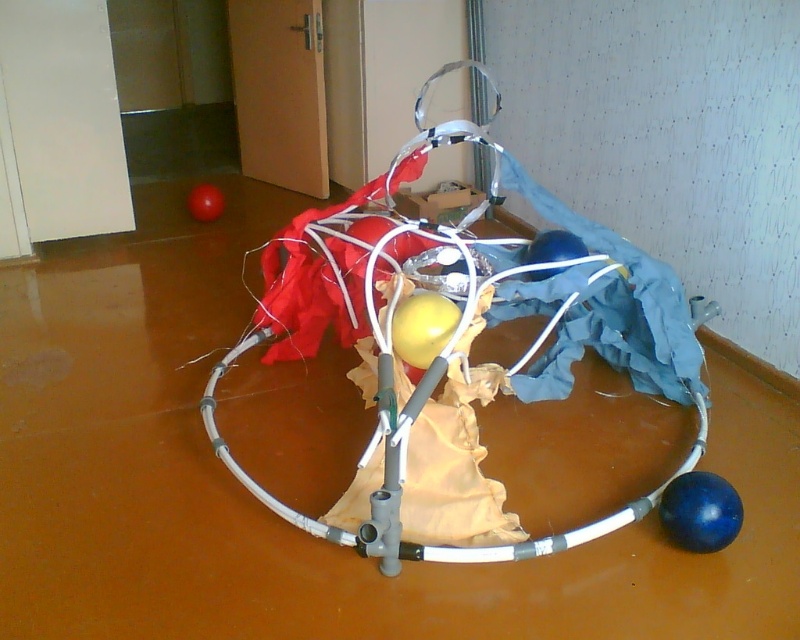
You are standing in front of the circular pipe structure and notice two points marked on it. The first point is at coordinates point (409, 449) and the second is at point (670, 534). Which of these points is closer to you?

Point (409, 449) is closer to you because it is further to the viewer than point (670, 534).

You are an interior designer arranging a modern art exhibit. You need to place a new sculpture that requires a clear path from the entrance to the center of the room. The entrance is near the blue rubber ball at lower right. Is the path from the entrance to the metallic wire frame at center unobstructed?

The metallic wire frame at center is to the left of the blue rubber ball at lower right, so the path from the entrance near the blue rubber ball at lower right to the metallic wire frame at center would be unobstructed as they are positioned side by side horizontally.

You are an interior designer assessing the placement of the metallic wire frame at center and the blue rubber ball at lower right in the image. Which object is positioned higher in the scene?

The metallic wire frame at center is above the blue rubber ball at lower right, so it is positioned higher in the scene.